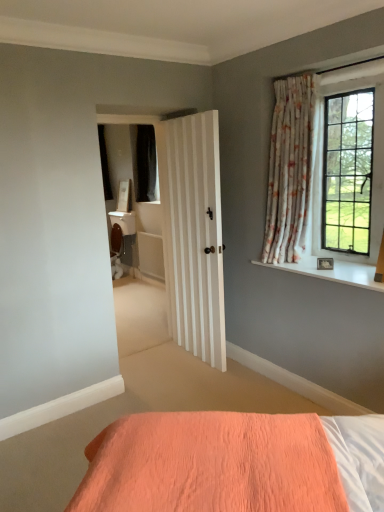
Describe the element at coordinates (289, 169) in the screenshot. Image resolution: width=384 pixels, height=512 pixels. I see `floral fabric curtain at upper right` at that location.

In order to face floral fabric curtain at upper right, should I rotate leftwards or rightwards?

Turn right approximately 12.720 degrees to face it.

This screenshot has width=384, height=512. Describe the element at coordinates (332, 272) in the screenshot. I see `white smooth window sill at upper right` at that location.

This screenshot has height=512, width=384. I want to click on floral fabric curtain at upper right, so click(289, 169).

Where is `window that is above the white smooth window sill at upper right (from a real-world perspective)`? The height and width of the screenshot is (512, 384). window that is above the white smooth window sill at upper right (from a real-world perspective) is located at coordinates (348, 172).

Are clear glass window at upper right and white smooth window sill at upper right making contact?

clear glass window at upper right is not next to white smooth window sill at upper right, and they're not touching.

How much distance is there between clear glass window at upper right and white smooth window sill at upper right?

clear glass window at upper right is 21.46 inches from white smooth window sill at upper right.

Considering the positions of objects clear glass window at upper right and white smooth window sill at upper right in the image provided, who is more to the left, clear glass window at upper right or white smooth window sill at upper right?

From the viewer's perspective, white smooth window sill at upper right appears more on the left side.

Which is in front, clear glass window at upper right or floral fabric curtain at upper right?

clear glass window at upper right is closer to the camera.

Which of these two, clear glass window at upper right or floral fabric curtain at upper right, stands taller?

Standing taller between the two is floral fabric curtain at upper right.

Based on the photo, considering the sizes of clear glass window at upper right and floral fabric curtain at upper right in the image, is clear glass window at upper right bigger or smaller than floral fabric curtain at upper right?

clear glass window at upper right is smaller than floral fabric curtain at upper right.

Could you tell me if clear glass window at upper right is turned towards floral fabric curtain at upper right?

Yes, clear glass window at upper right is turned towards floral fabric curtain at upper right.

Would you say floral fabric curtain at upper right is outside clear glass window at upper right?

floral fabric curtain at upper right is positioned outside clear glass window at upper right.

Between floral fabric curtain at upper right and clear glass window at upper right, which one has less height?

clear glass window at upper right is shorter.

In the scene shown: Considering the relative sizes of floral fabric curtain at upper right and clear glass window at upper right in the image provided, is floral fabric curtain at upper right wider than clear glass window at upper right?

Yes.

Which object is more forward, floral fabric curtain at upper right or clear glass window at upper right?

clear glass window at upper right.

From a real-world perspective, between floral fabric curtain at upper right and white smooth window sill at upper right, who is vertically higher?

floral fabric curtain at upper right is physically above.

You are a GUI agent. You are given a task and a screenshot of the screen. Output one action in this format:
    pyautogui.click(x=<x>, y=<y>)
    Task: Click on the window sill that appears on the right of floral fabric curtain at upper right
    
    Given the screenshot: What is the action you would take?
    pyautogui.click(x=332, y=272)

From the image's perspective, is floral fabric curtain at upper right located above white smooth window sill at upper right?

Yes.

Between floral fabric curtain at upper right and white smooth window sill at upper right, which one has smaller width?

floral fabric curtain at upper right is thinner.

Relative to floral fabric curtain at upper right, is white smooth window sill at upper right in front or behind?

white smooth window sill at upper right is positioned closer to the viewer than floral fabric curtain at upper right.

From a real-world perspective, is white smooth window sill at upper right located higher than floral fabric curtain at upper right?

No, from a real-world perspective, white smooth window sill at upper right is not over floral fabric curtain at upper right

Which of these two, white smooth window sill at upper right or floral fabric curtain at upper right, is smaller?

white smooth window sill at upper right is smaller.

Looking at this image, considering the relative positions of white smooth window sill at upper right and clear glass window at upper right in the image provided, is white smooth window sill at upper right to the right of clear glass window at upper right from the viewer's perspective?

No.

Which of these two, white smooth window sill at upper right or clear glass window at upper right, is bigger?

clear glass window at upper right.

How many degrees apart are the facing directions of white smooth window sill at upper right and clear glass window at upper right?

0.00234 degrees separate the facing orientations of white smooth window sill at upper right and clear glass window at upper right.

From the picture: Is white smooth window sill at upper right positioned beyond the bounds of clear glass window at upper right?

Yes, white smooth window sill at upper right is located beyond the bounds of clear glass window at upper right.

Locate an element on the screen. The height and width of the screenshot is (512, 384). window sill on the left of clear glass window at upper right is located at coordinates (332, 272).

You are a GUI agent. You are given a task and a screenshot of the screen. Output one action in this format:
    pyautogui.click(x=<x>, y=<y>)
    Task: Click on the window in front of the floral fabric curtain at upper right
    The width and height of the screenshot is (384, 512).
    Given the screenshot: What is the action you would take?
    pyautogui.click(x=348, y=172)

Looking at the image, which one is located closer to clear glass window at upper right, white smooth window sill at upper right or floral fabric curtain at upper right?

The object closer to clear glass window at upper right is floral fabric curtain at upper right.

Based on their spatial positions, is clear glass window at upper right or white smooth window sill at upper right closer to floral fabric curtain at upper right?

clear glass window at upper right is positioned closer to the anchor floral fabric curtain at upper right.

Considering their positions, is white smooth window sill at upper right positioned closer to floral fabric curtain at upper right than clear glass window at upper right?

Based on the image, clear glass window at upper right appears to be nearer to floral fabric curtain at upper right.

Considering their positions, is clear glass window at upper right positioned further to white smooth window sill at upper right than floral fabric curtain at upper right?

Among the two, floral fabric curtain at upper right is located further to white smooth window sill at upper right.

From the picture: Based on their spatial positions, is floral fabric curtain at upper right or clear glass window at upper right further from white smooth window sill at upper right?

Among the two, floral fabric curtain at upper right is located further to white smooth window sill at upper right.

From the image, which object appears to be farther from clear glass window at upper right, floral fabric curtain at upper right or white smooth window sill at upper right?

white smooth window sill at upper right is further to clear glass window at upper right.

I want to click on curtain that lies between clear glass window at upper right and white smooth window sill at upper right from top to bottom, so click(289, 169).